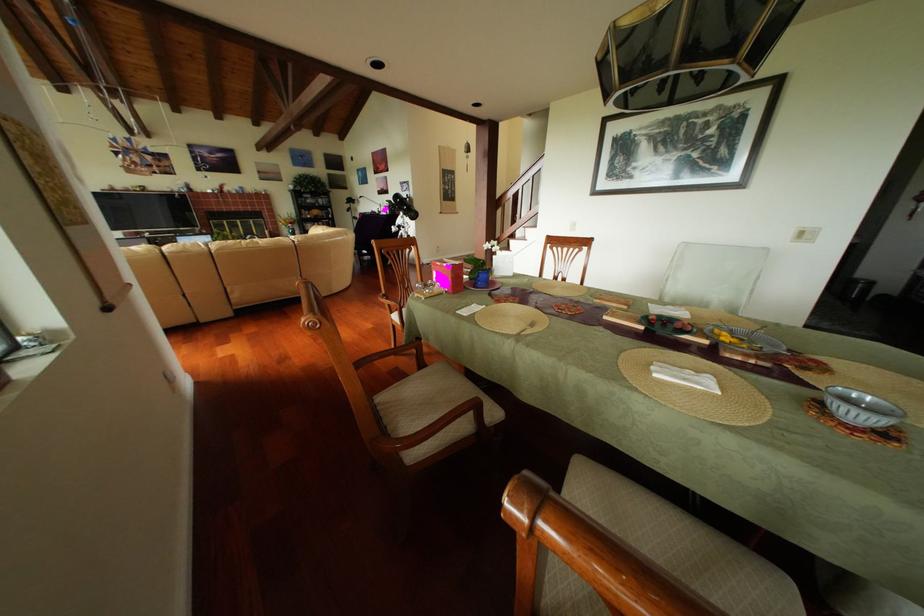
The location [481,277] corresponds to which object?

It corresponds to the blue flower pot in the image.